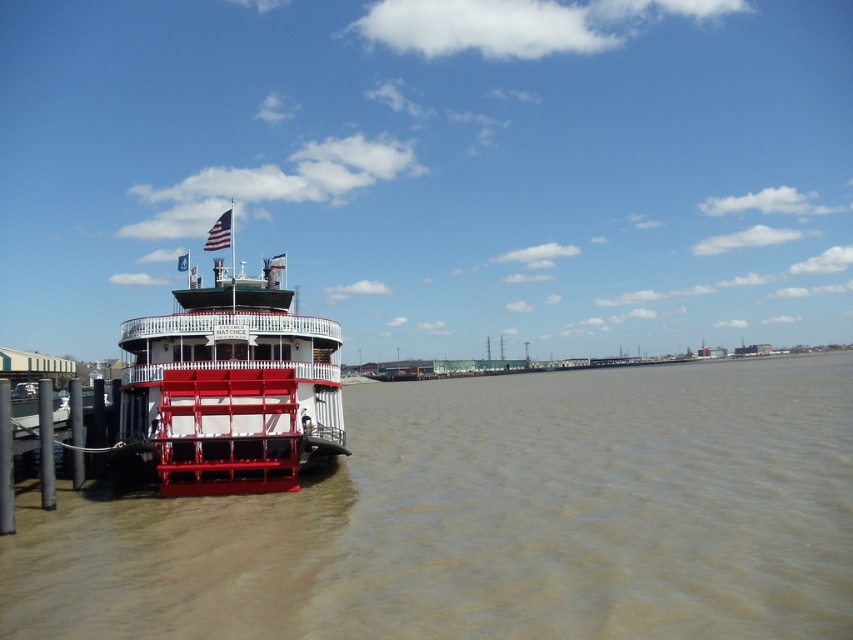
You are a tourist standing on the pier and want to take a photo of the white matte paddlewheel boat at left and the american flag at upper left. Which object should you frame first in your camera viewfinder to ensure both are in the shot?

You should frame the american flag at upper left first because the white matte paddlewheel boat at left is to the right of it, so positioning the flag first allows the boat to be included to its right in the frame.

Based on the photo, you are standing on the pier and want to walk towards the riverboat. There are two points marked on the pier walkway at coordinates point (x=563, y=484) and point (x=160, y=449). Which point should you step on first to reach the riverboat?

You should step on point (x=160, y=449) first because it is closer to the riverboat than point (x=563, y=484), which is further away from the boat.

You are standing on the pier and see the point marked at coordinates (230,388). Based on the scene description, where is this point located?

The point is located on the white matte paddlewheel boat at left.